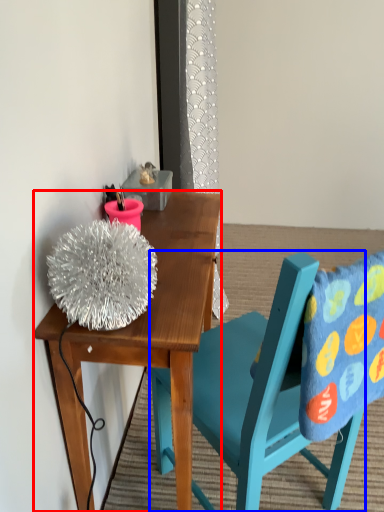
Question: Which object appears farthest to the camera in this image, desk (highlighted by a red box) or chair (highlighted by a blue box)?

Choices:
 (A) desk
 (B) chair

Answer: (A)